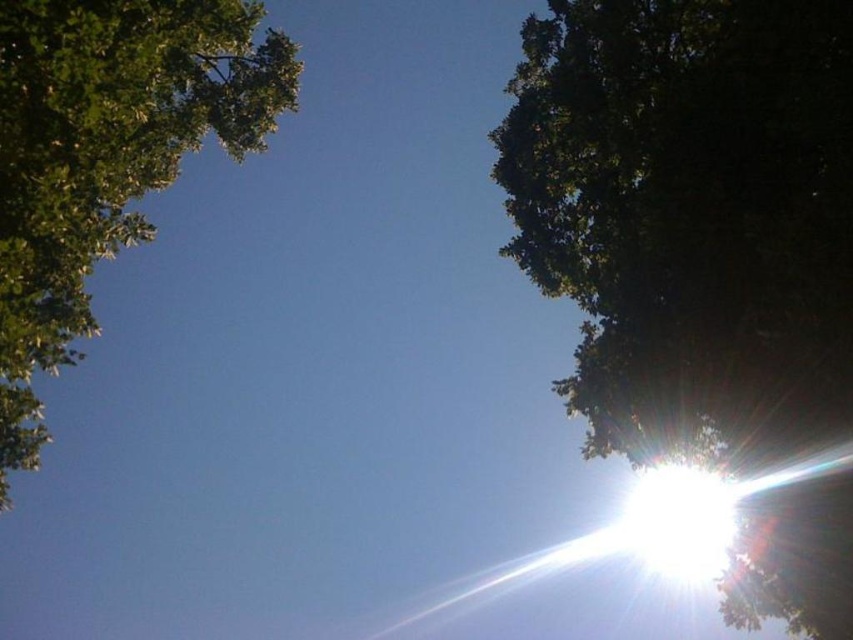
You are standing in the middle of the scene and notice the green leafy tree at upper right and the green leafy tree at upper left. Which tree is positioned to the east?

The green leafy tree at upper right is positioned to the east because it is to the right of the green leafy tree at upper left, and since the sun is in the lower right, the scene is oriented with east on the right side.